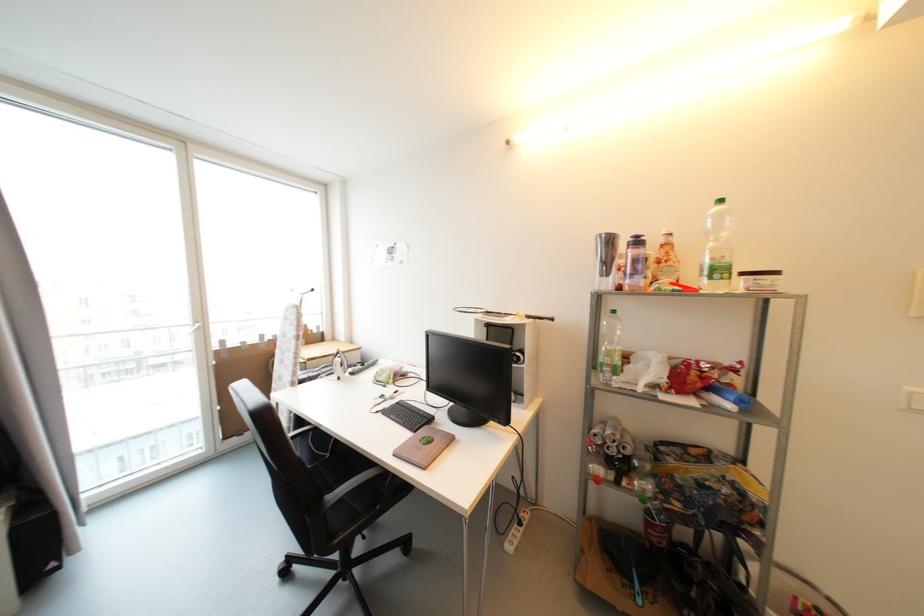
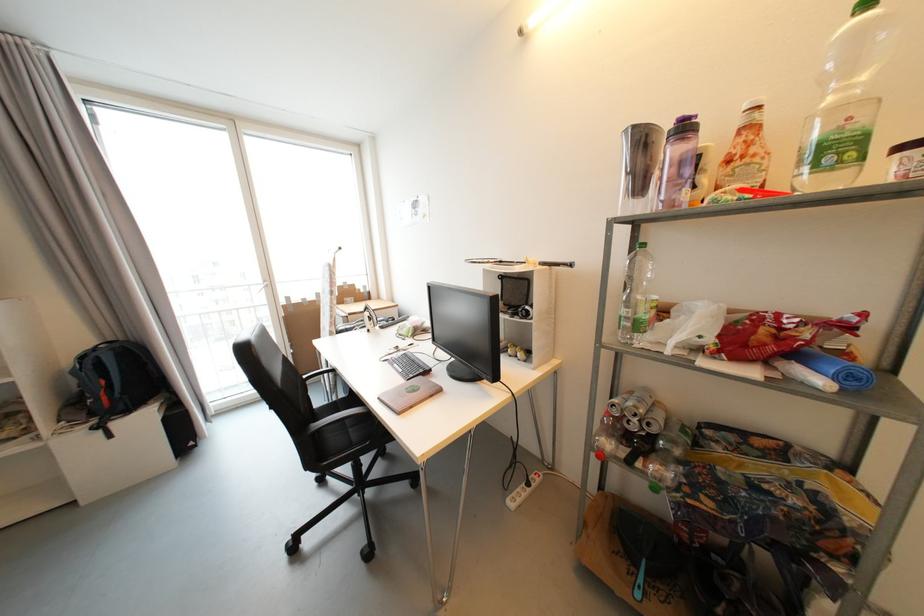
The point at (x=672, y=262) is marked in the first image. Where is the corresponding point in the second image?

(748, 159)